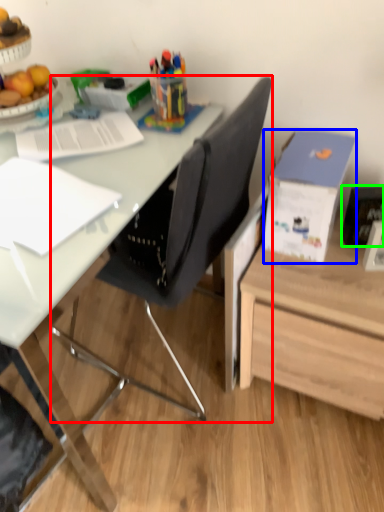
Question: Based on their relative distances, which object is nearer to chair (highlighted by a red box)? Choose from box (highlighted by a blue box) and picture frame (highlighted by a green box).

Choices:
 (A) box
 (B) picture frame

Answer: (A)